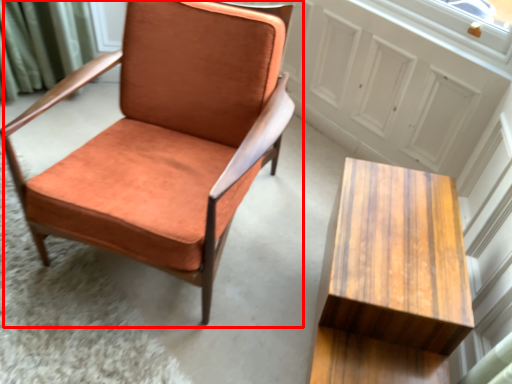
Question: From the image's perspective, what is the correct spatial positioning of chair (annotated by the red box) in reference to table?

Choices:
 (A) above
 (B) below

Answer: (A)